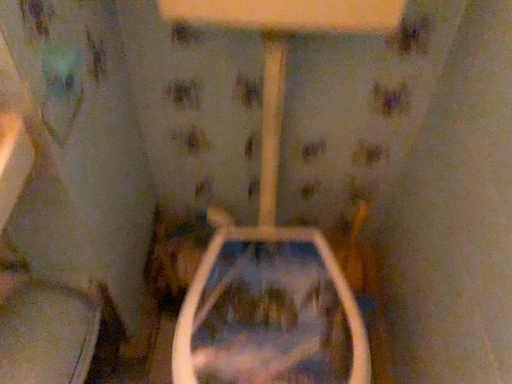
Identify the location of white plastic lamp at center. The width and height of the screenshot is (512, 384). (276, 143).

What do you see at coordinates (276, 143) in the screenshot?
I see `white plastic lamp at center` at bounding box center [276, 143].

Locate an element on the screen. The height and width of the screenshot is (384, 512). white plastic lamp at center is located at coordinates (276, 143).